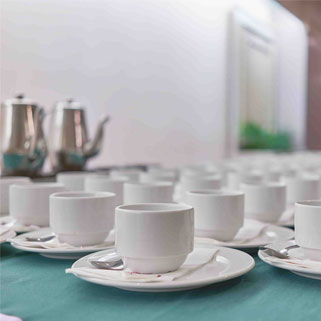
Image resolution: width=321 pixels, height=321 pixels. Identify the location of coffee pot. (22, 129), (75, 128).